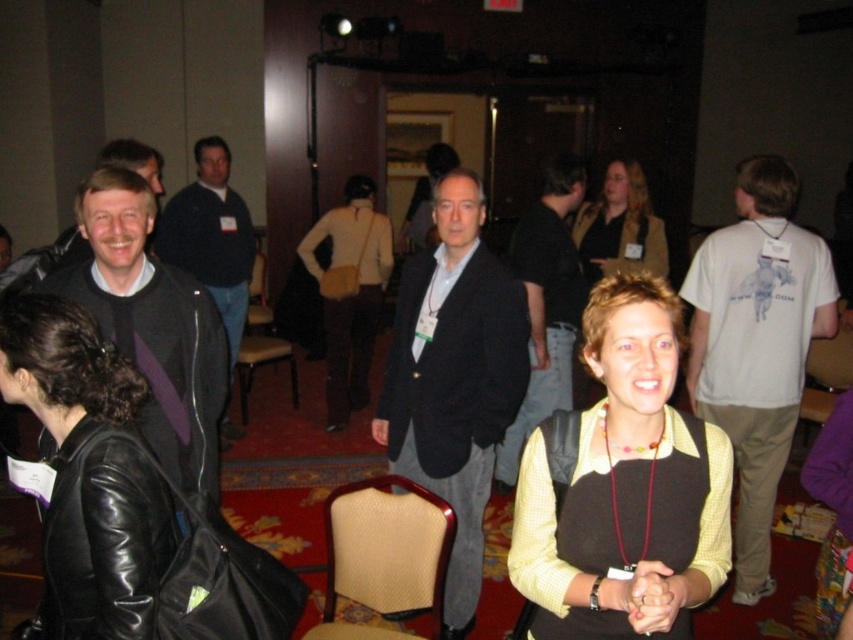
Is the position of dark gray blazer at center more distant than that of dark gray suit at center?

No, dark gray blazer at center is closer to the viewer.

Does dark gray blazer at center appear over dark gray suit at center?

Actually, dark gray blazer at center is below dark gray suit at center.

What are the coordinates of `dark gray blazer at center` in the screenshot? It's located at (454, 378).

Can you confirm if white cotton t-shirt at right is positioned to the left of black leather jacket at left?

No, white cotton t-shirt at right is not to the left of black leather jacket at left.

Which is above, white cotton t-shirt at right or black leather jacket at left?

black leather jacket at left is above.

Is point (764, 561) less distant than point (245, 266)?

Yes, it is.

Where is `white cotton t-shirt at right`? white cotton t-shirt at right is located at coordinates 756,344.

Between point (454, 442) and point (776, 221), which one is positioned behind?

The point (776, 221) is more distant.

Can you confirm if dark gray blazer at center is positioned to the left of white cotton t-shirt at right?

Yes, dark gray blazer at center is to the left of white cotton t-shirt at right.

This screenshot has height=640, width=853. What are the coordinates of `dark gray blazer at center` in the screenshot? It's located at (454, 378).

Locate an element on the screen. dark gray blazer at center is located at coordinates (454, 378).